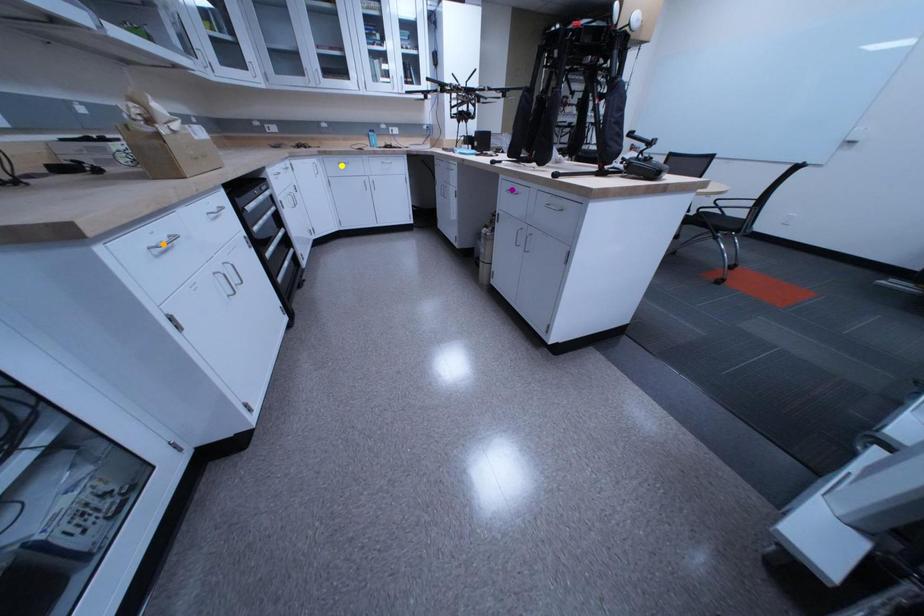
In the scene shown: Order these from farthest to nearest:
1. yellow point
2. purple point
3. orange point

yellow point < purple point < orange point